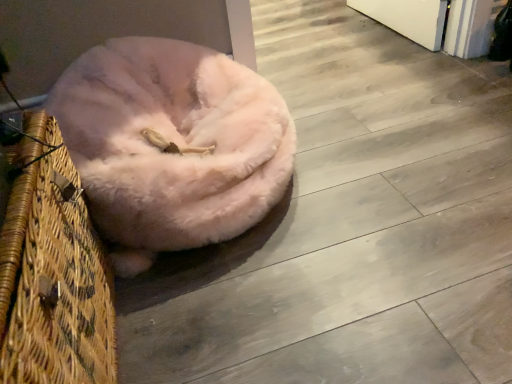
The height and width of the screenshot is (384, 512). Identify the location of free location to the right of fuzzy pink dog bed at center. (406, 182).